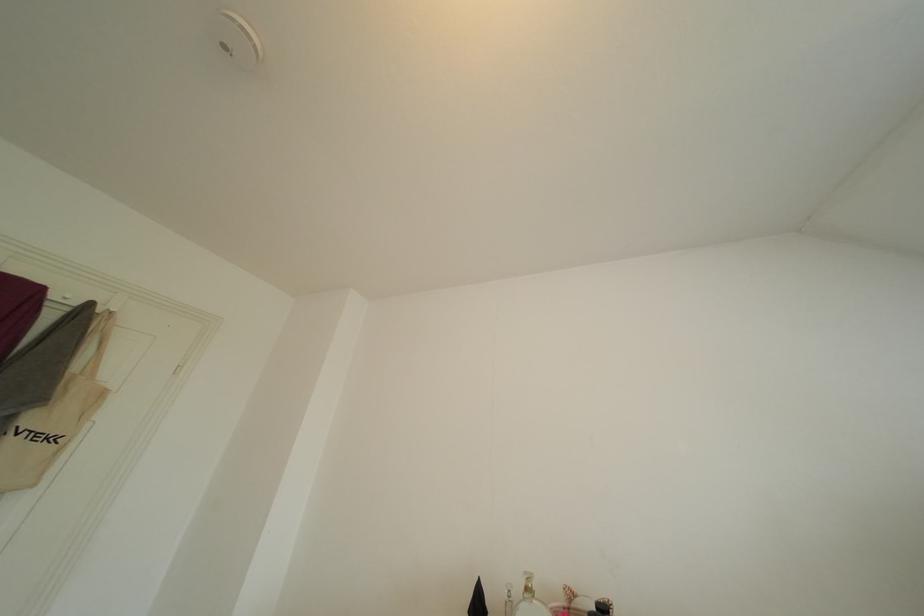
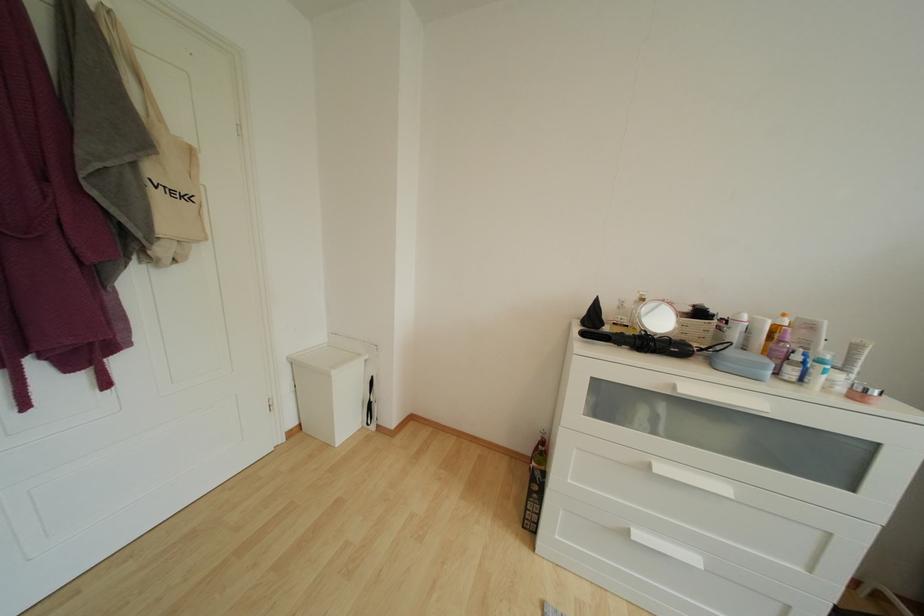
Locate, in the second image, the point that corresponds to point (540, 588) in the first image.

(651, 301)